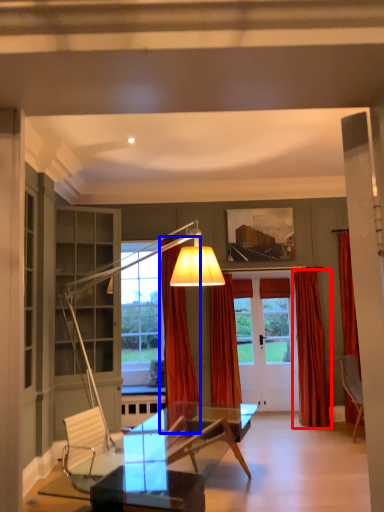
Question: Which point is further to the camera, curtain (highlighted by a red box) or curtain (highlighted by a blue box)?

Choices:
 (A) curtain
 (B) curtain

Answer: (A)